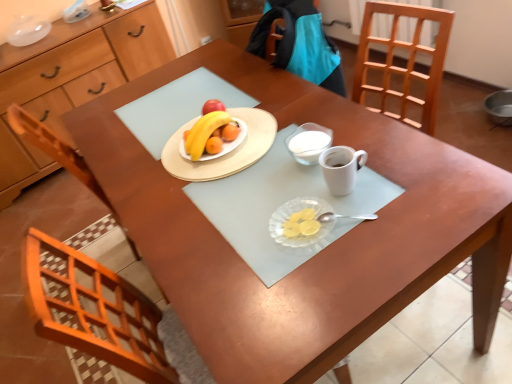
Identify the location of vacant space that's between transparent glass plate at center and yellow matte grapefruit at center. This screenshot has height=384, width=512. (258, 186).